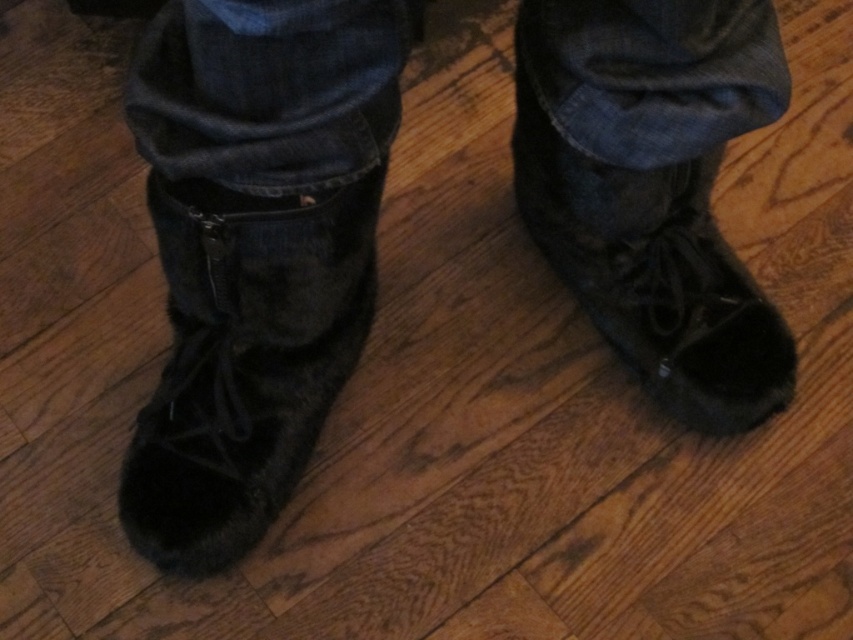
From the picture: You are a fashion designer trying to place a new accessory between the fuzzy black boots at center and the black suede boot at center. What is the minimum space required to fit the accessory between them?

The minimum space required to fit the accessory between the fuzzy black boots at center and the black suede boot at center is 3.62 inches, as they are currently 3.62 inches apart.

Based on the photo, you are a photographer trying to capture a closeup of the fuzzy black boots at center. The camera is currently positioned 27.07 inches away. If the camera needs to be at least 30 inches away to avoid distortion, is the current distance sufficient?

The fuzzy black boots at center and camera are 27.07 inches apart from each other. Since 27.07 inches is less than 30 inches, the current distance is not sufficient to avoid distortion. Move the camera back to at least 30 inches away.

You are a photographer setting up a shoot. You need to ensure that the denim at center is visible without being blocked by the black suede boot at center. Based on the scene description, is this possible?

Yes, the denim at center is in front of the black suede boot at center, so it remains visible and not blocked by the boot.